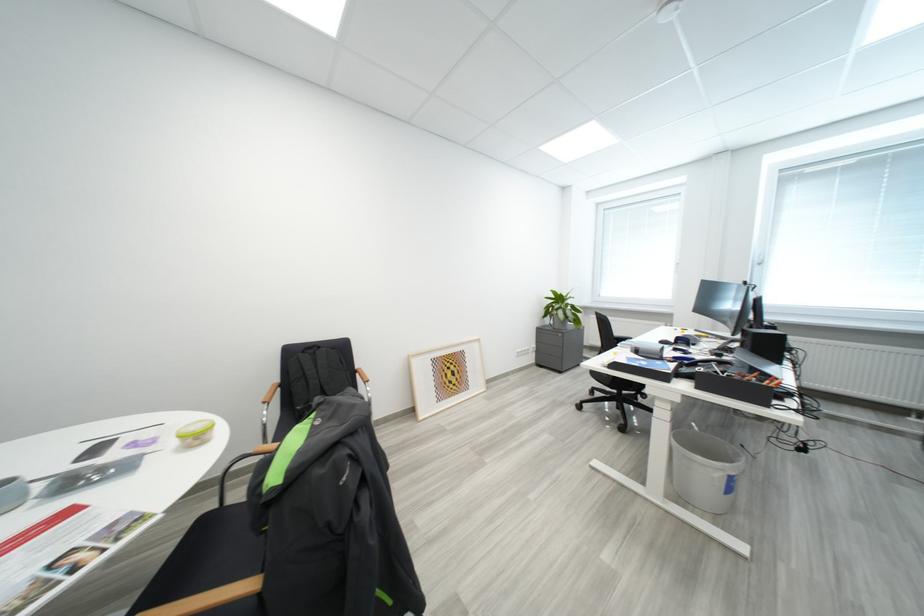
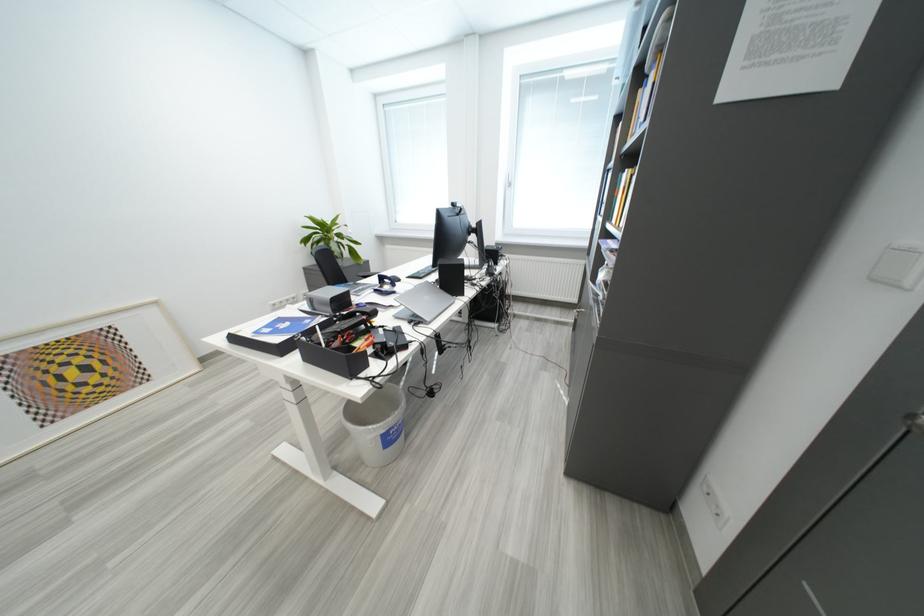
Find the pixel in the second image that matches [707,390] in the first image.

(315, 362)